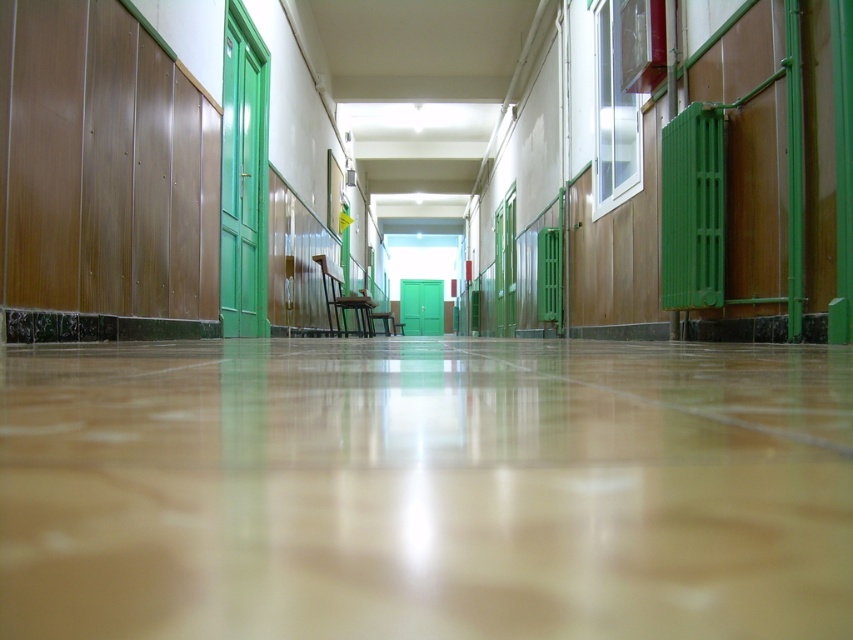
Does wooden chair at center have a lesser height compared to brown wooden chair at center?

No.

Measure the distance between point (357, 307) and camera.

8.93 meters

This screenshot has width=853, height=640. I want to click on wooden chair at center, so tap(341, 300).